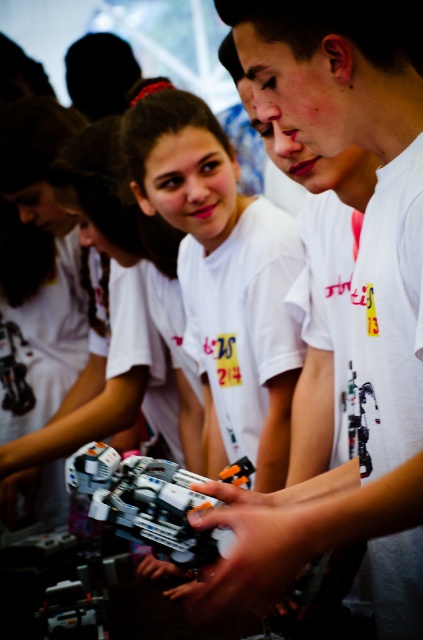
Question: Which point is closer to the camera taking this photo?

Choices:
 (A) coord(411,301)
 (B) coord(236,168)
 (C) coord(57,193)

Answer: (A)

Question: In this image, where is matte white robot at center located relative to plastic toy car at center?

Choices:
 (A) above
 (B) below

Answer: (A)

Question: Does white matte t-shirt at upper center come in front of matte white robot at center?

Choices:
 (A) no
 (B) yes

Answer: (B)

Question: Is white matte robot at center to the right of plastic toy car at center from the viewer's perspective?

Choices:
 (A) yes
 (B) no

Answer: (A)

Question: Which object appears farthest from the camera in this image?

Choices:
 (A) white matte robot at center
 (B) plastic toy car at center
 (C) white matte t-shirt at upper center
 (D) matte white robot at center

Answer: (D)

Question: Which point is farther to the camera?

Choices:
 (A) white matte t-shirt at upper center
 (B) matte white robot at center
 (C) plastic toy car at center

Answer: (B)